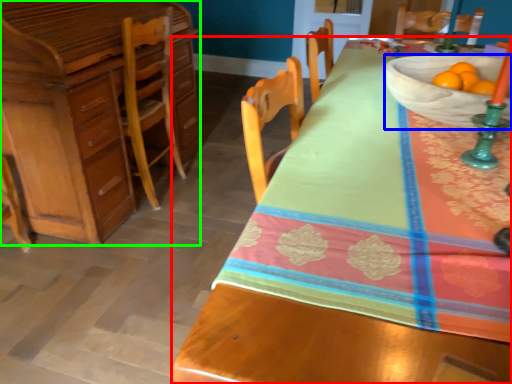
Question: Considering the real-world distances, which object is farthest from desk (highlighted by a red box)? bowl (highlighted by a blue box) or cabinetry (highlighted by a green box)?

Choices:
 (A) bowl
 (B) cabinetry

Answer: (B)